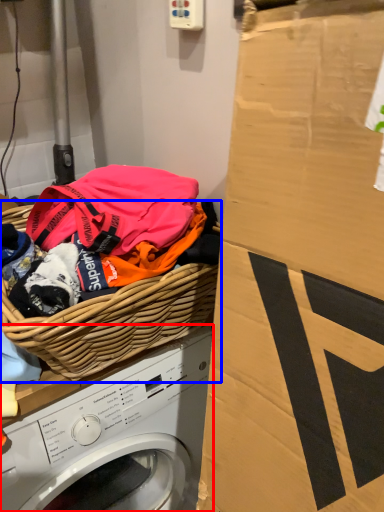
Question: Among these objects, which one is nearest to the camera, washing machine (highlighted by a red box) or basket (highlighted by a blue box)?

Choices:
 (A) washing machine
 (B) basket

Answer: (B)